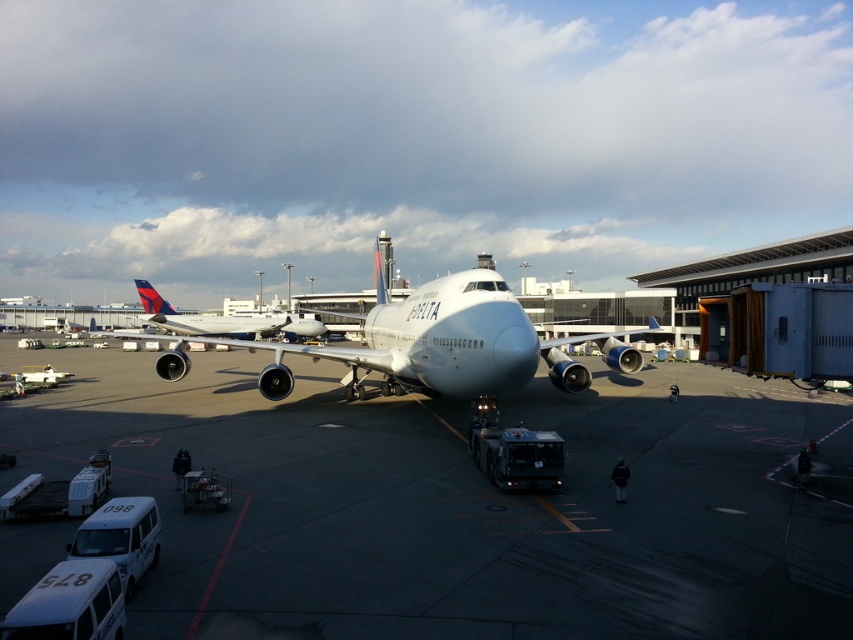
Measure the distance between white smooth tarmac at center and camera.

They are 5.78 meters apart.

Looking at this image, is white smooth tarmac at center smaller than white glossy airplane at center?

Yes.

Where is `white smooth tarmac at center`? This screenshot has width=853, height=640. white smooth tarmac at center is located at coordinates (460, 504).

At what (x,y) coordinates should I click in order to perform the action: click on white glossy airplane at center. Please return your answer as a coordinate pair (x, y). This screenshot has width=853, height=640. Looking at the image, I should click on (444, 342).

Does white glossy airplane at center appear under matte white airplane at center?

No.

Does point (357, 387) come behind point (192, 323)?

That is False.

Identify the location of white glossy airplane at center. This screenshot has width=853, height=640. (444, 342).

Is white smooth tarmac at center to the right of matte white airplane at center from the viewer's perspective?

Yes, white smooth tarmac at center is to the right of matte white airplane at center.

Is white smooth tarmac at center bigger than matte white airplane at center?

No, white smooth tarmac at center is not bigger than matte white airplane at center.

The width and height of the screenshot is (853, 640). Identify the location of white smooth tarmac at center. (460, 504).